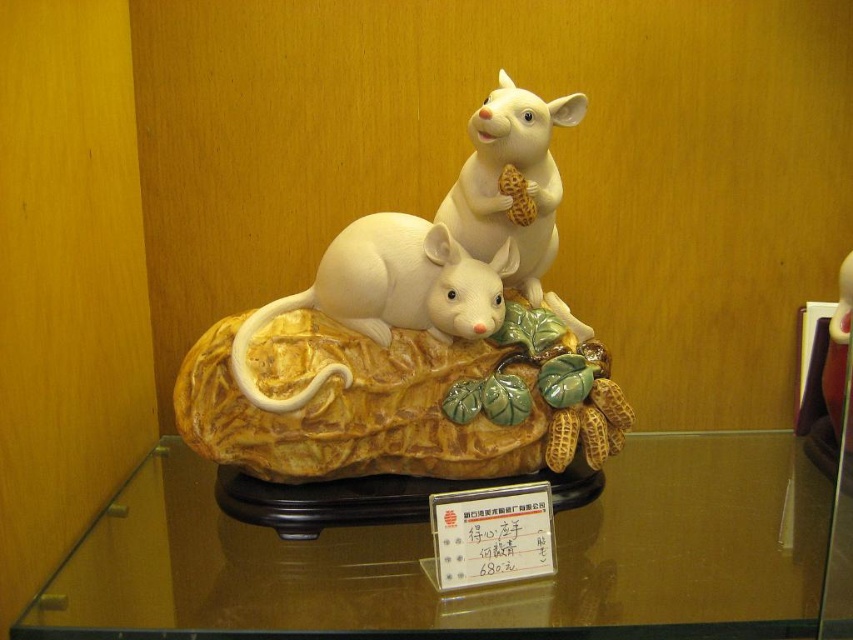
You are placing a small decorative item on the transparent glass table at center. The white glossy mouse at center is already on the table. Where should you place the new item so it doesn not block the mouse?

The transparent glass table at center is below white glossy mouse at center, so placing the new item on the table surface away from the mouse would ensure it doesn not block the mouse.

You are arranging a display in a gallery and need to place a new sculpture on the transparent glass table at center. However, there is a white glossy mouse at center already on the table. Where should you place the new sculpture so it doesn not block the view of the mouse?

Place the new sculpture to the left of the white glossy mouse at center since the transparent glass table at center is to the right of it, so placing it there will keep the mouse visible.

You are an art curator arranging the display. You notice the white glossy mice at center and the white glossy mouse at center in the sculpture. Which one is positioned lower in the scene?

The white glossy mice at center is positioned lower than the white glossy mouse at center according to the description.